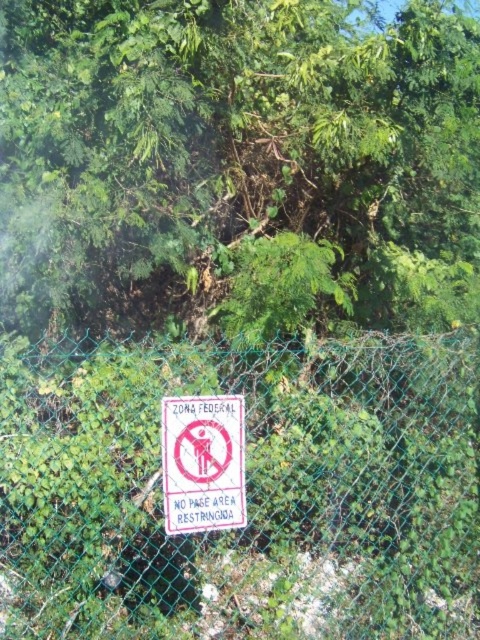
Question: Can you confirm if green leafy tree at center is thinner than green mesh fence at center?

Choices:
 (A) no
 (B) yes

Answer: (A)

Question: Which is nearer to the white paper sign at center?

Choices:
 (A) green leafy tree at center
 (B) green mesh fence at center

Answer: (B)

Question: Does green mesh fence at center appear on the left side of white paper sign at center?

Choices:
 (A) no
 (B) yes

Answer: (A)

Question: Among these objects, which one is farthest from the camera?

Choices:
 (A) white paper sign at center
 (B) green mesh fence at center

Answer: (B)

Question: Which of these objects is positioned closest to the green mesh fence at center?

Choices:
 (A) white paper sign at center
 (B) green leafy tree at center

Answer: (A)

Question: Does green leafy tree at center have a greater width compared to green mesh fence at center?

Choices:
 (A) no
 (B) yes

Answer: (B)